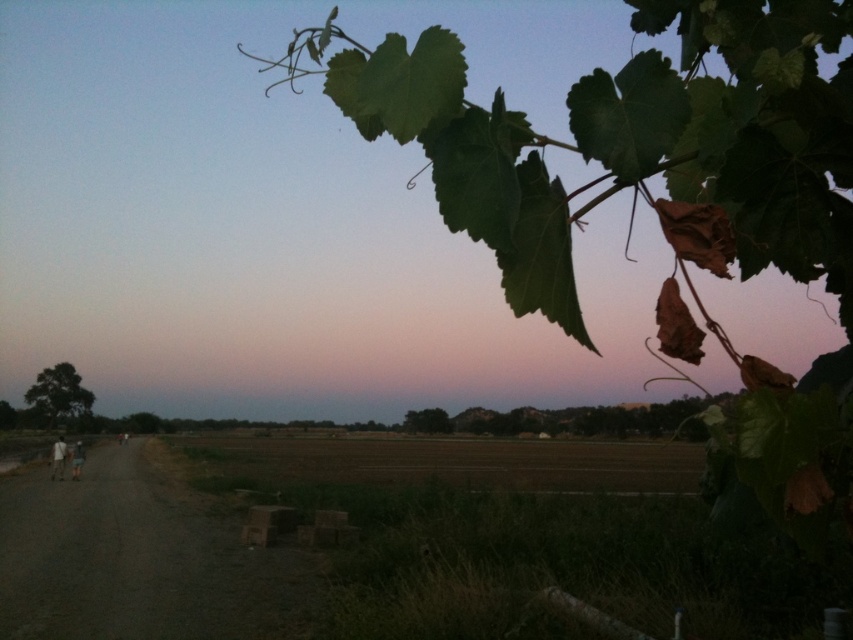
Which is behind, point (259, 618) or point (61, 456)?

The point (61, 456) is more distant.

Describe the element at coordinates (138, 561) in the screenshot. I see `dark brown dirt track at lower left` at that location.

Where is `dark brown dirt track at lower left`? The image size is (853, 640). dark brown dirt track at lower left is located at coordinates point(138,561).

Is point (544, 460) positioned behind point (79, 461)?

Yes, point (544, 460) is behind point (79, 461).

Between brown soil at center and white fabric person at lower left, which one appears on the right side from the viewer's perspective?

From the viewer's perspective, brown soil at center appears more on the right side.

This screenshot has width=853, height=640. What do you see at coordinates (444, 461) in the screenshot? I see `brown soil at center` at bounding box center [444, 461].

At what (x,y) coordinates should I click in order to perform the action: click on brown soil at center. Please return your answer as a coordinate pair (x, y). The height and width of the screenshot is (640, 853). Looking at the image, I should click on (444, 461).

Is light brown fabric pants at left above white fabric person at lower left?

Yes, light brown fabric pants at left is above white fabric person at lower left.

From the picture: Does light brown fabric pants at left appear on the right side of white fabric person at lower left?

In fact, light brown fabric pants at left is to the left of white fabric person at lower left.

Where is `light brown fabric pants at left`? light brown fabric pants at left is located at coordinates (57, 458).

I want to click on light brown fabric pants at left, so click(57, 458).